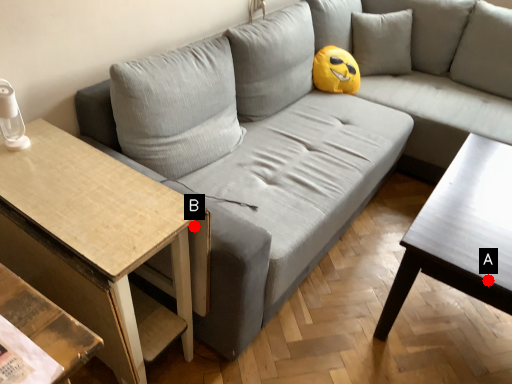
Question: Two points are circled on the image, labeled by A and B beside each circle. Among these points, which one is nearest to the camera?

Choices:
 (A) A is closer
 (B) B is closer

Answer: (B)